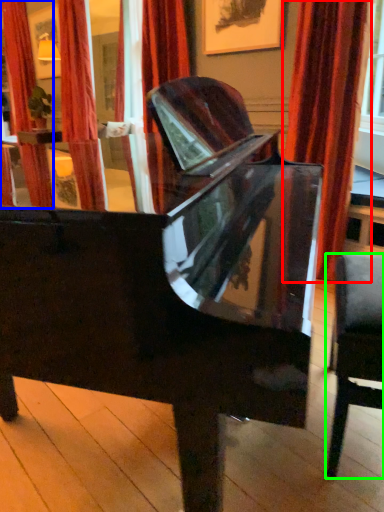
Question: Estimate the real-world distances between objects in this image. Which object is closer to curtain (highlighted by a red box), curtain (highlighted by a blue box) or chair (highlighted by a green box)?

Choices:
 (A) curtain
 (B) chair

Answer: (B)